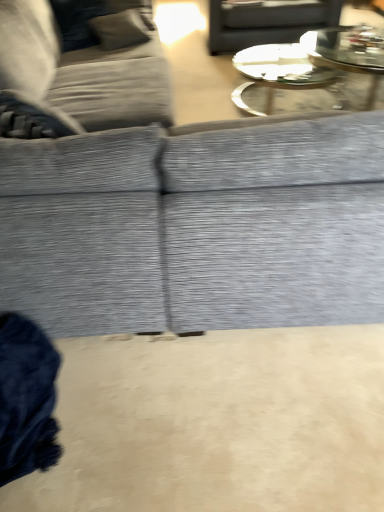
Question: Considering the relative sizes of clear glass coffee table at upper center and textured gray fabric couch at center, which is the second studio couch from left to right, in the image provided, is clear glass coffee table at upper center wider than textured gray fabric couch at center, which is the second studio couch from left to right,?

Choices:
 (A) yes
 (B) no

Answer: (B)

Question: Considering the relative sizes of clear glass coffee table at upper center and textured gray fabric couch at center, positioned as the 1th studio couch in right-to-left order, in the image provided, is clear glass coffee table at upper center thinner than textured gray fabric couch at center, positioned as the 1th studio couch in right-to-left order,?

Choices:
 (A) no
 (B) yes

Answer: (B)

Question: From a real-world perspective, is clear glass coffee table at upper center located higher than textured gray fabric couch at center, which is the second studio couch from left to right?

Choices:
 (A) yes
 (B) no

Answer: (B)

Question: Is clear glass coffee table at upper center not close to textured gray fabric couch at center, which is the second studio couch from left to right?

Choices:
 (A) yes
 (B) no

Answer: (A)

Question: Is clear glass coffee table at upper center shorter than textured gray fabric couch at center, which is the second studio couch from left to right?

Choices:
 (A) yes
 (B) no

Answer: (A)

Question: Is textured gray couch at upper left, which is counted as the 2th studio couch, starting from the right, taller or shorter than textured gray fabric couch at center, which is the second studio couch from left to right?

Choices:
 (A) tall
 (B) short

Answer: (A)

Question: Choose the correct answer: Is textured gray couch at upper left, which is counted as the 2th studio couch, starting from the right, inside textured gray fabric couch at center, which is the second studio couch from left to right, or outside it?

Choices:
 (A) outside
 (B) inside

Answer: (B)

Question: From a real-world perspective, is textured gray couch at upper left, which is counted as the 2th studio couch, starting from the right, above or below textured gray fabric couch at center, positioned as the 1th studio couch in right-to-left order?

Choices:
 (A) above
 (B) below

Answer: (A)

Question: Is point (38, 49) positioned closer to the camera than point (66, 247)?

Choices:
 (A) closer
 (B) farther

Answer: (B)

Question: Is textured gray fabric couch at center, which is the second studio couch from left to right, inside or outside of clear glass coffee table at upper center?

Choices:
 (A) inside
 (B) outside

Answer: (B)

Question: From a real-world perspective, is textured gray fabric couch at center, positioned as the 1th studio couch in right-to-left order, physically located above or below clear glass coffee table at upper center?

Choices:
 (A) above
 (B) below

Answer: (A)

Question: Relative to clear glass coffee table at upper center, is textured gray fabric couch at center, positioned as the 1th studio couch in right-to-left order, in front or behind?

Choices:
 (A) front
 (B) behind

Answer: (A)

Question: Does point (31, 152) appear closer or farther from the camera than point (299, 47)?

Choices:
 (A) closer
 (B) farther

Answer: (A)

Question: In the image, is textured gray couch at upper left, which ranks as the first studio couch in left-to-right order, on the left side or the right side of matte gray tray at upper center?

Choices:
 (A) left
 (B) right

Answer: (A)

Question: In the image, is textured gray couch at upper left, which ranks as the first studio couch in left-to-right order, positioned in front of or behind matte gray tray at upper center?

Choices:
 (A) front
 (B) behind

Answer: (A)